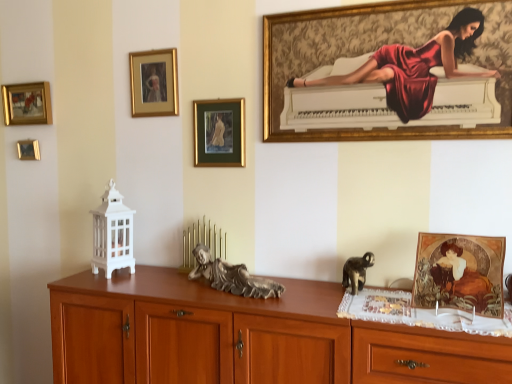
Find the location of a particular element. This screenshot has width=512, height=384. free space on the front side of silver metallic statue at center, positioned as the first animal in left-to-right order is located at coordinates (244, 304).